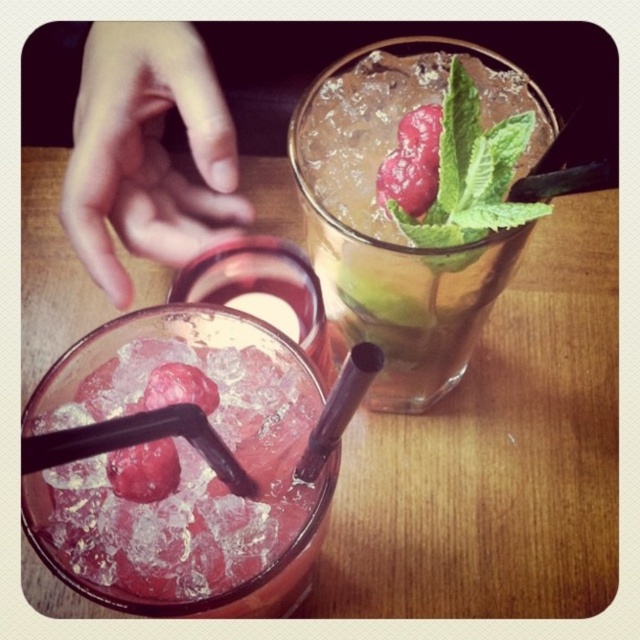
Question: Among these objects, which one is farthest from the camera?

Choices:
 (A) pink bracelet at upper left
 (B) glossy red raspberry at center
 (C) translucent glass at center

Answer: (A)

Question: Which object appears farthest from the camera in this image?

Choices:
 (A) pink bracelet at upper left
 (B) clear glass at upper right
 (C) wooden table at center

Answer: (A)

Question: Where is translucent glass at center located in relation to clear glass at upper right in the image?

Choices:
 (A) above
 (B) below

Answer: (B)

Question: Can you confirm if translucent glass at center is positioned above clear glass at upper right?

Choices:
 (A) yes
 (B) no

Answer: (B)

Question: Is translucent glass at center wider than clear glass at upper right?

Choices:
 (A) no
 (B) yes

Answer: (B)

Question: Among these objects, which one is nearest to the camera?

Choices:
 (A) glossy red raspberry at center
 (B) translucent glass at center
 (C) pink bracelet at upper left
 (D) clear glass at upper right

Answer: (B)